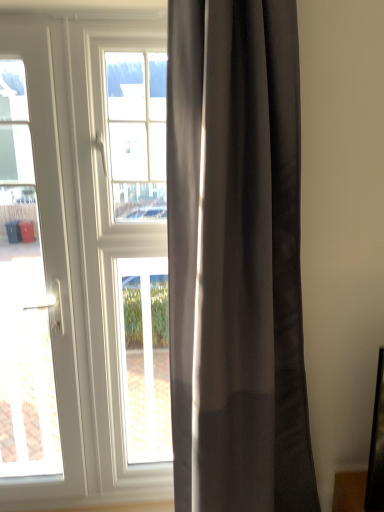
This screenshot has height=512, width=384. What do you see at coordinates (145, 357) in the screenshot?
I see `clear glass window at center` at bounding box center [145, 357].

Find the location of a particular element. The height and width of the screenshot is (512, 384). clear glass window at center is located at coordinates (145, 357).

Find the location of a particular element. This screenshot has height=512, width=384. satin gray curtain at center is located at coordinates (236, 258).

The image size is (384, 512). Describe the element at coordinates (137, 133) in the screenshot. I see `white glass window at center` at that location.

The image size is (384, 512). Find the location of `white glass window at center`. white glass window at center is located at coordinates (137, 133).

The image size is (384, 512). What do you see at coordinates (50, 262) in the screenshot?
I see `white glossy door at left` at bounding box center [50, 262].

In order to click on clear glass window at center in this screenshot , I will do `click(145, 357)`.

Is white glossy door at left bigger than clear glass window at center?

Yes, white glossy door at left is bigger than clear glass window at center.

Is white glossy door at left positioned with its back to clear glass window at center?

That's not correct — white glossy door at left is not looking away from clear glass window at center.

Considering the relative positions of white glossy door at left and clear glass window at center in the image provided, is white glossy door at left to the left of clear glass window at center from the viewer's perspective?

Indeed, white glossy door at left is positioned on the left side of clear glass window at center.

Is white glossy door at left not within clear glass window at center?

Indeed, white glossy door at left is completely outside clear glass window at center.

Which object is thinner, satin gray curtain at center or white glass window at center?

With smaller width is white glass window at center.

From a real-world perspective, is satin gray curtain at center over white glass window at center?

No, from a real-world perspective, satin gray curtain at center is not on top of white glass window at center.

In terms of height, does satin gray curtain at center look taller or shorter compared to white glass window at center?

Clearly, satin gray curtain at center is taller compared to white glass window at center.

Which object is closer to the camera, satin gray curtain at center or white glass window at center?

Positioned in front is satin gray curtain at center.

Is point (61, 262) closer to viewer compared to point (214, 204)?

No.

Between white glossy door at left and satin gray curtain at center, which one is positioned in front?

satin gray curtain at center is more forward.

Considering the sizes of objects white glossy door at left and satin gray curtain at center in the image provided, who is smaller, white glossy door at left or satin gray curtain at center?

With smaller size is white glossy door at left.

From the image's perspective, is white glossy door at left above or below satin gray curtain at center?

Based on their image positions, white glossy door at left is located beneath satin gray curtain at center.

Considering the positions of objects clear glass window at center and satin gray curtain at center in the image provided, who is more to the left, clear glass window at center or satin gray curtain at center?

clear glass window at center.

From a real-world perspective, which is physically above, clear glass window at center or satin gray curtain at center?

satin gray curtain at center, from a real-world perspective.

Could you tell me if clear glass window at center is facing satin gray curtain at center?

No.

Locate an element on the screen. curtain above the clear glass window at center (from the image's perspective) is located at coordinates (236, 258).

Considering the points (131, 339) and (110, 91), which point is in front, point (131, 339) or point (110, 91)?

The point (110, 91) is in front.

Between clear glass window at center and white glass window at center, which one appears on the right side from the viewer's perspective?

clear glass window at center.

Based on the photo, from the image's perspective, which object appears higher, clear glass window at center or white glass window at center?

white glass window at center appears higher in the image.

From a real-world perspective, is clear glass window at center on top of white glass window at center?

No, from a real-world perspective, clear glass window at center is not on top of white glass window at center.

Where is `bay window above the clear glass window at center (from a real-world perspective)`? The width and height of the screenshot is (384, 512). bay window above the clear glass window at center (from a real-world perspective) is located at coordinates (137, 133).

In the scene shown: Is white glass window at center bigger than clear glass window at center?

Correct, white glass window at center is larger in size than clear glass window at center.

Which object is further away from the camera, white glass window at center or clear glass window at center?

clear glass window at center is behind.

Are white glass window at center and clear glass window at center making contact?

white glass window at center and clear glass window at center are clearly separated.

Considering the sizes of objects satin gray curtain at center and clear glass window at center in the image provided, who is bigger, satin gray curtain at center or clear glass window at center?

With larger size is satin gray curtain at center.

Is satin gray curtain at center wider or thinner than clear glass window at center?

In the image, satin gray curtain at center appears to be wider than clear glass window at center.

Does satin gray curtain at center contain clear glass window at center?

Definitely not — clear glass window at center is not inside satin gray curtain at center.

Which is more distant, (x=189, y=476) or (x=167, y=338)?

The point (x=167, y=338) is behind.

Where is `door above the clear glass window at center (from the image's perspective)`? Image resolution: width=384 pixels, height=512 pixels. door above the clear glass window at center (from the image's perspective) is located at coordinates (50, 262).

This screenshot has width=384, height=512. In order to click on curtain below the white glass window at center (from a real-world perspective) in this screenshot , I will do `click(236, 258)`.

Estimate the real-world distances between objects in this image. Which object is closer to clear glass window at center, white glossy door at left or satin gray curtain at center?

white glossy door at left is positioned closer to the anchor clear glass window at center.

Looking at the image, which one is located further to clear glass window at center, white glass window at center or white glossy door at left?

Based on the image, white glass window at center appears to be further to clear glass window at center.

Based on their spatial positions, is clear glass window at center or satin gray curtain at center further from white glass window at center?

Among the two, clear glass window at center is located further to white glass window at center.

Considering their positions, is white glass window at center positioned closer to satin gray curtain at center than clear glass window at center?

white glass window at center lies closer to satin gray curtain at center than the other object.

Which object lies nearer to the anchor point clear glass window at center, white glossy door at left or white glass window at center?

white glossy door at left is closer to clear glass window at center.

Looking at the image, which one is located further to white glossy door at left, satin gray curtain at center or clear glass window at center?

satin gray curtain at center is positioned further to the anchor white glossy door at left.

Looking at the image, which one is located closer to clear glass window at center, satin gray curtain at center or white glossy door at left?

white glossy door at left is positioned closer to the anchor clear glass window at center.

From the image, which object appears to be nearer to white glossy door at left, clear glass window at center or satin gray curtain at center?

The object closer to white glossy door at left is clear glass window at center.

Identify the location of window between white glossy door at left and satin gray curtain at center from left to right. The height and width of the screenshot is (512, 384). (145, 357).

Identify the location of door between white glass window at center and clear glass window at center in the vertical direction. Image resolution: width=384 pixels, height=512 pixels. (50, 262).

Image resolution: width=384 pixels, height=512 pixels. In order to click on curtain between white glass window at center and clear glass window at center vertically in this screenshot , I will do `click(236, 258)`.

Where is `bay window located between white glossy door at left and satin gray curtain at center in the left-right direction`? bay window located between white glossy door at left and satin gray curtain at center in the left-right direction is located at coordinates (137, 133).